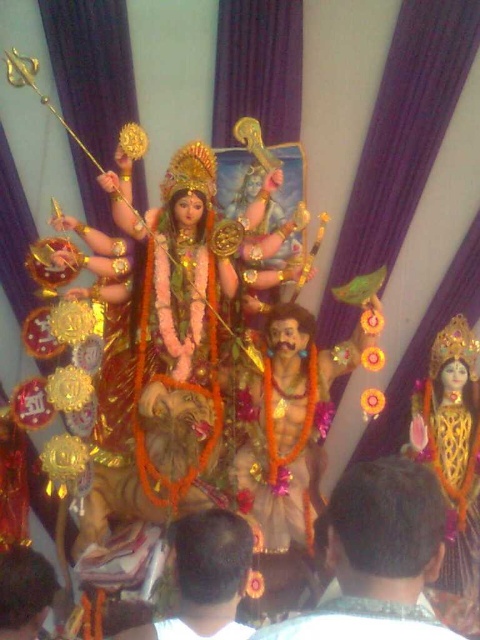
Question: Estimate the real-world distances between objects in this image. Which object is closer to the brown hair at lower center?

Choices:
 (A) brown textured hair at center
 (B) dark brown hair at lower left

Answer: (A)

Question: Is brown textured hair at center wider than brown hair at lower center?

Choices:
 (A) yes
 (B) no

Answer: (A)

Question: Which point appears closest to the camera in this image?

Choices:
 (A) (417, 618)
 (B) (219, 584)

Answer: (A)

Question: Which object appears farthest from the camera in this image?

Choices:
 (A) dark brown hair at lower left
 (B) brown hair at lower center
 (C) brown textured hair at center

Answer: (A)

Question: From the image, what is the correct spatial relationship of brown textured hair at center in relation to brown hair at lower center?

Choices:
 (A) above
 (B) below

Answer: (A)

Question: Is brown textured hair at center to the right of brown hair at lower center from the viewer's perspective?

Choices:
 (A) no
 (B) yes

Answer: (B)